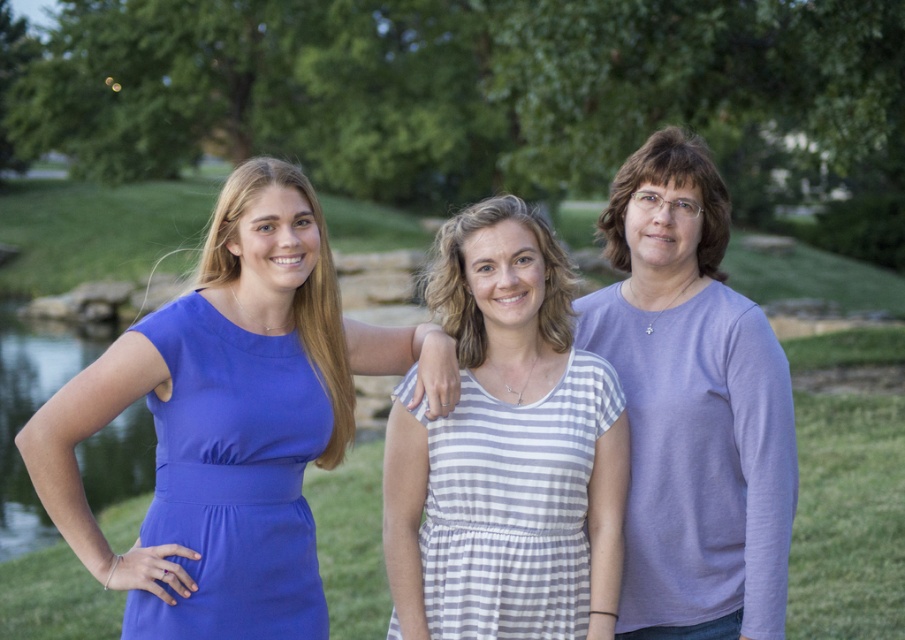
You are a photographer setting up a tripod to capture a group photo of the purple cotton shirt at center and the blue fabric dress at left. To ensure both subjects are fully visible from the waist up, which subject requires a higher camera angle?

The purple cotton shirt at center is shorter than the blue fabric dress at left, so the photographer should use a higher camera angle for the purple cotton shirt at center to ensure it is fully visible from the waist up.

You are trying to decide which outfit takes up more visual space in the photo. Which one is smaller in size between the purple cotton shirt at center and the blue fabric dress at left?

The purple cotton shirt at center occupies less space than the blue fabric dress at left, so the purple cotton shirt at center is smaller in size.

You are trying to decide which clothing item to choose for a casual day out. You see the matte purple sweater at center and the white striped fabric dress at center in the image. Based on their sizes, which one is wider?

The matte purple sweater at center is wider than the white striped fabric dress at center according to the description.